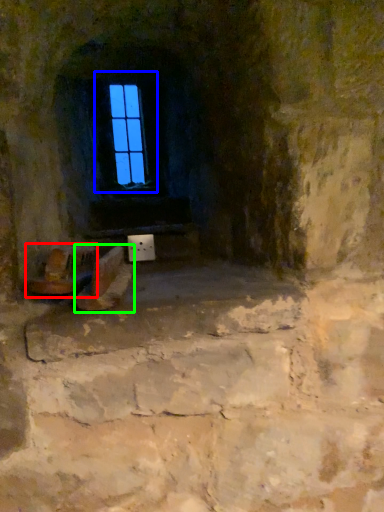
Question: Which object is positioned closest to chair (highlighted by a red box)? Select from window (highlighted by a blue box) and footwear (highlighted by a green box).

Choices:
 (A) window
 (B) footwear

Answer: (B)